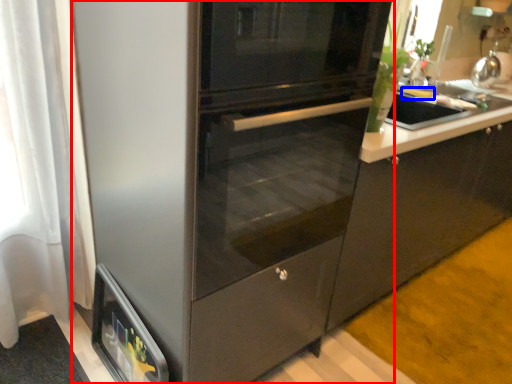
Question: Which of the following is the closest to the observer, fridge (highlighted by a red box) or food (highlighted by a blue box)?

Choices:
 (A) fridge
 (B) food

Answer: (A)